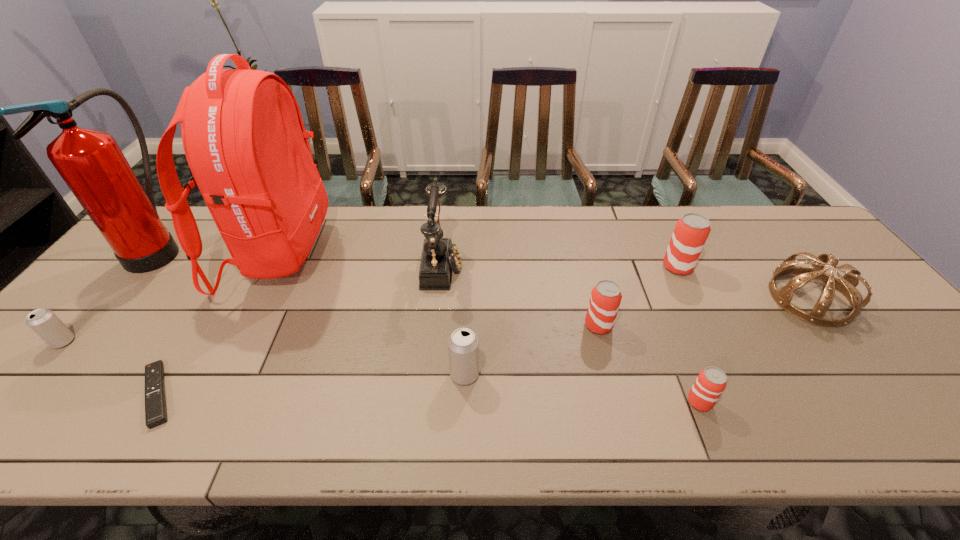
You are a GUI agent. You are given a task and a screenshot of the screen. Output one action in this format:
    pyautogui.click(x=<x>, y=<y>)
    Task: Click on the vacant region between the smaller white beer can and the red backpack
    The width and height of the screenshot is (960, 540).
    Given the screenshot: What is the action you would take?
    pyautogui.click(x=171, y=298)

Locate an element on the screen. empty space that is in between the fourth object from right to left and the nearest orange beer can is located at coordinates (649, 364).

At what (x,y) coordinates should I click in order to perform the action: click on blank region between the fire extinguisher and the fourth beer can from left to right. Please return your answer as a coordinate pair (x, y). The height and width of the screenshot is (540, 960). Looking at the image, I should click on (429, 325).

Find the location of a particular element. free space between the second nearest orange beer can and the rightmost orange beer can is located at coordinates (638, 296).

Locate an element on the screen. free space between the second farthest orange beer can and the red fire extinguisher is located at coordinates (378, 287).

Find the location of `vacant area that lies between the red fire extinguisher and the bigger white beer can`. vacant area that lies between the red fire extinguisher and the bigger white beer can is located at coordinates [312, 311].

Image resolution: width=960 pixels, height=540 pixels. Identify the location of vacant area that lies between the eighth shortest object and the rightmost beer can. (560, 266).

The image size is (960, 540). What are the coordinates of `vacant area that lies between the red backpack and the farthest orange beer can` in the screenshot? It's located at (478, 260).

Identify the location of free point between the second farthest orange beer can and the remote control. (377, 360).

Identify which object is the seventh closest to the brown tiara. Please provide its 2D coordinates. Your answer should be formatted as a tuple, i.e. [(x, y)], where the tuple contains the x and y coordinates of a point satisfying the conditions above.

[(155, 403)]